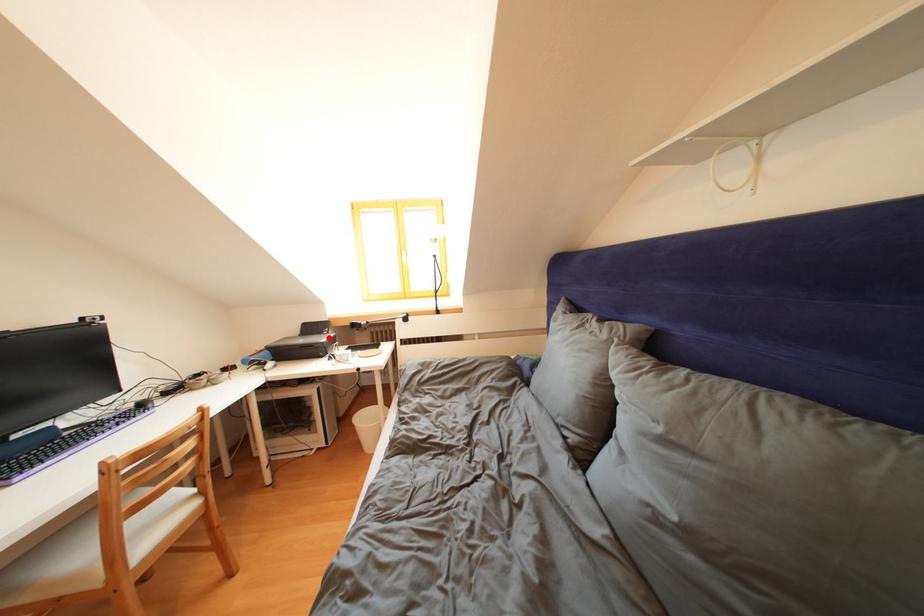
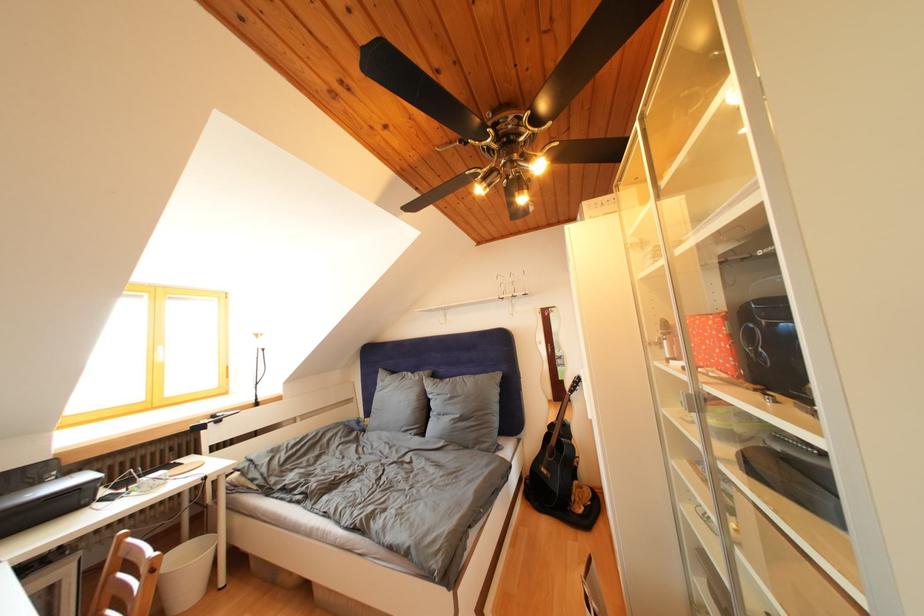
Where in the second image is the point corresponding to the highlighted location from the first image?

(44, 488)